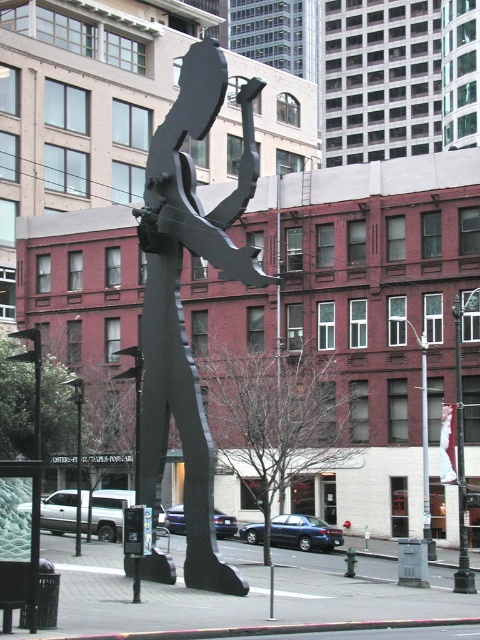
You are a city planner reviewing the layout of this urban space. You need to determine the placement of a new bench. The bench must be placed to the right of both the black metal sculpture at center and the metallic pole at center. Is this possible?

The black metal sculpture at center is positioned on the left side of metallic pole at center, so placing the bench to the right of both would require it to be placed to the right of the metallic pole at center, which is feasible.

You are a city planner assessing the space between the black metal sculpture at center and the metallic pole at center. Which object is taller?

The black metal sculpture at center is taller than the metallic pole at center.

You are a city planner assessing the placement of the black metal sculpture at center and the metallic pole at center. Based on their positioning, can you determine if the sculpture is resting on the pole?

The black metal sculpture at center is positioned over metallic pole at center, so yes, the sculpture is resting on the pole.